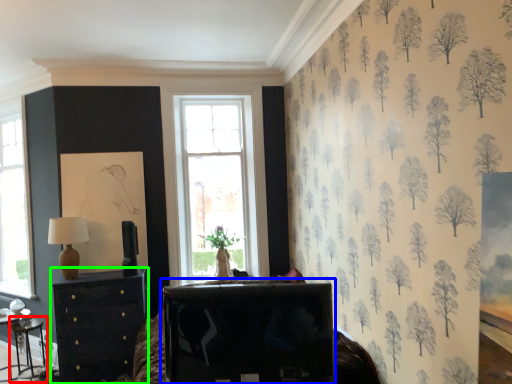
Question: Which object is positioned farthest from table (highlighted by a red box)? Select from table (highlighted by a blue box) and chest of drawers (highlighted by a green box).

Choices:
 (A) table
 (B) chest of drawers

Answer: (A)